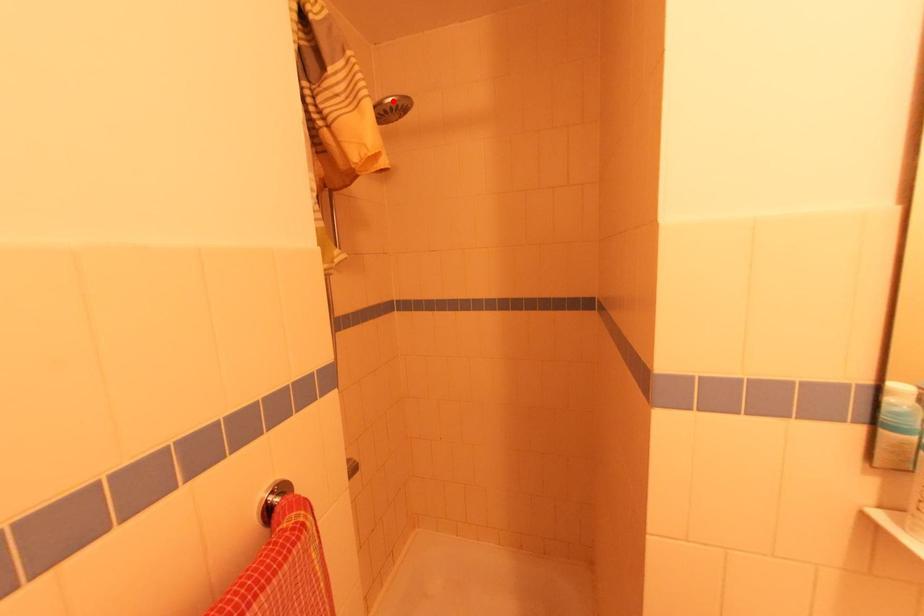
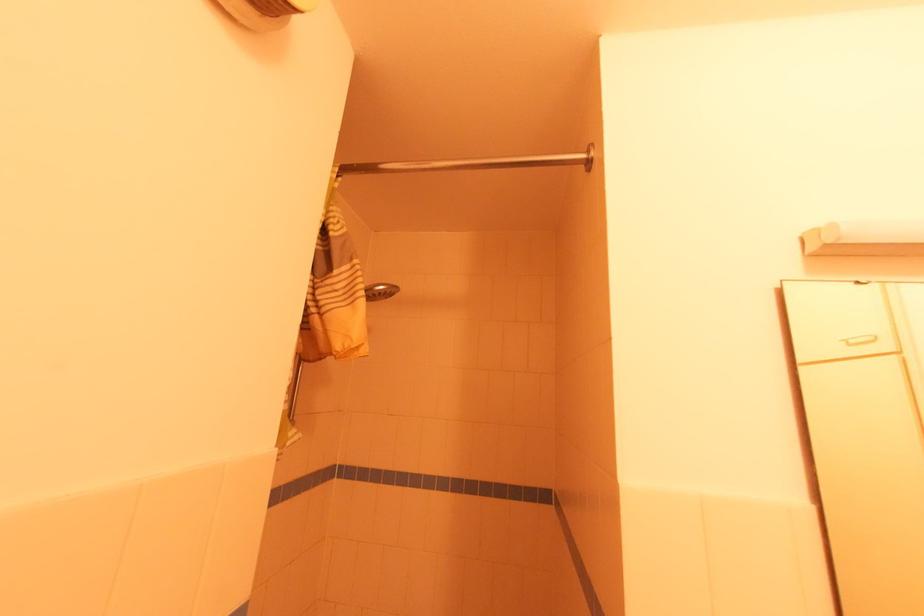
Locate, in the second image, the point that corresponds to the highlighted location in the first image.

(383, 288)